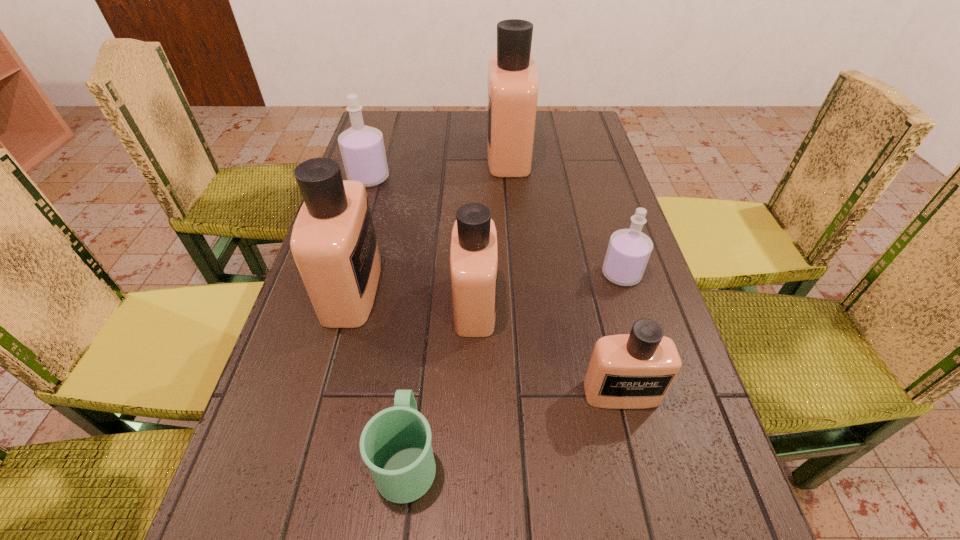
The width and height of the screenshot is (960, 540). What are the coordinates of `the smallest beige perfume` in the screenshot? It's located at (626, 371).

Locate an element on the screen. Image resolution: width=960 pixels, height=540 pixels. the third object from left to right is located at coordinates (395, 444).

Locate an element on the screen. the shortest object is located at coordinates (395, 444).

Where is `vacant space located on the front label of the biggest beige perfume`? vacant space located on the front label of the biggest beige perfume is located at coordinates (444, 154).

Locate an element on the screen. The image size is (960, 540). vacant space located 0.140m on the front label of the biggest beige perfume is located at coordinates click(441, 154).

Identify the location of vacant space located on the front label of the biggest beige perfume. This screenshot has width=960, height=540. (392, 154).

Where is `free space located 0.210m on the front label of the leftmost beige perfume`? This screenshot has width=960, height=540. free space located 0.210m on the front label of the leftmost beige perfume is located at coordinates (474, 289).

At what (x,y) coordinates should I click in order to perform the action: click on free region located 0.370m on the front of the farther purple perfume. Please return your answer as a coordinate pair (x, y). The width and height of the screenshot is (960, 540). Looking at the image, I should click on (334, 289).

Where is `free space located 0.090m on the front label of the second smallest beige perfume`? free space located 0.090m on the front label of the second smallest beige perfume is located at coordinates (539, 304).

Identify the location of vacant space positioned 0.110m on the front of the nearer purple perfume. Image resolution: width=960 pixels, height=540 pixels. (638, 329).